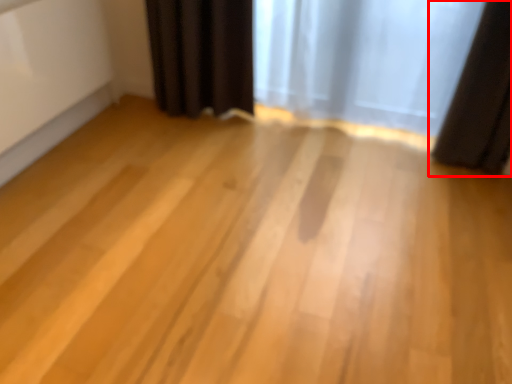
Question: From the image's perspective, considering the relative positions of curtain (annotated by the red box) and curtain in the image provided, where is curtain (annotated by the red box) located with respect to the staircase?

Choices:
 (A) below
 (B) above

Answer: (A)